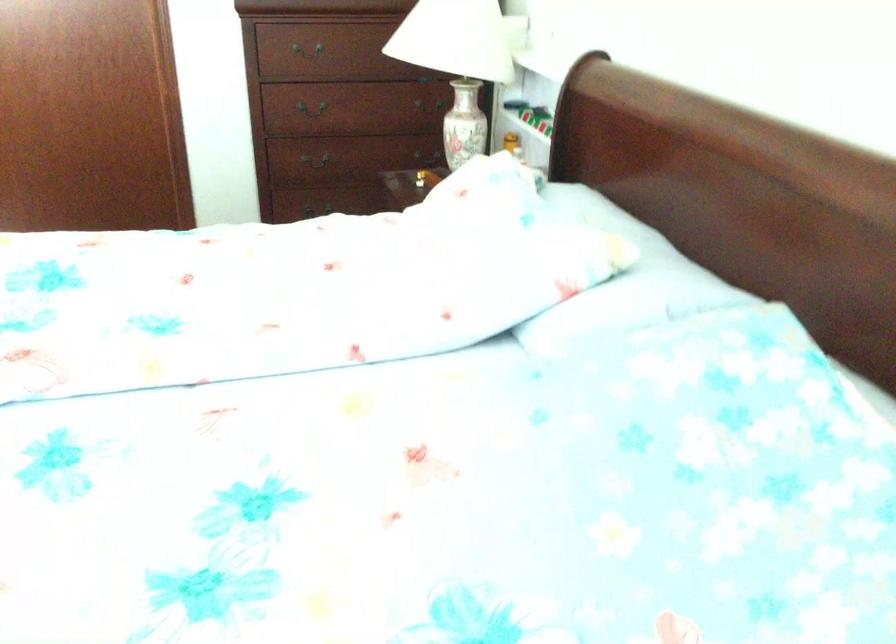
The location [618,275] corresponds to which object?

This point indicates the white floral pillow.